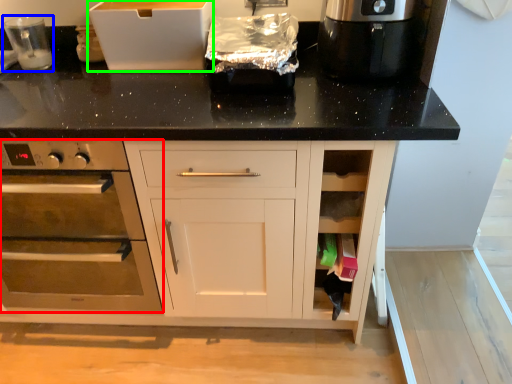
Question: Considering the real-world distances, which object is closest to home appliance (highlighted by a red box)? appliance (highlighted by a blue box) or cardboard box (highlighted by a green box).

Choices:
 (A) appliance
 (B) cardboard box

Answer: (B)